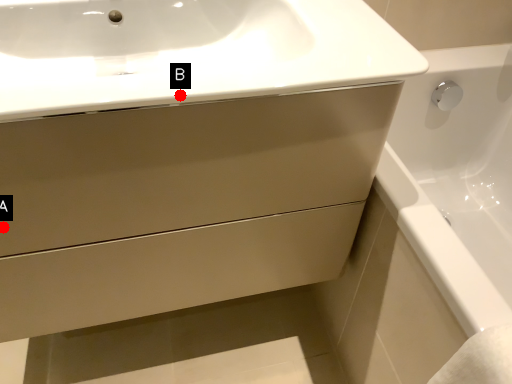
Question: Two points are circled on the image, labeled by A and B beside each circle. Which point is closer to the camera taking this photo?

Choices:
 (A) A is closer
 (B) B is closer

Answer: (B)